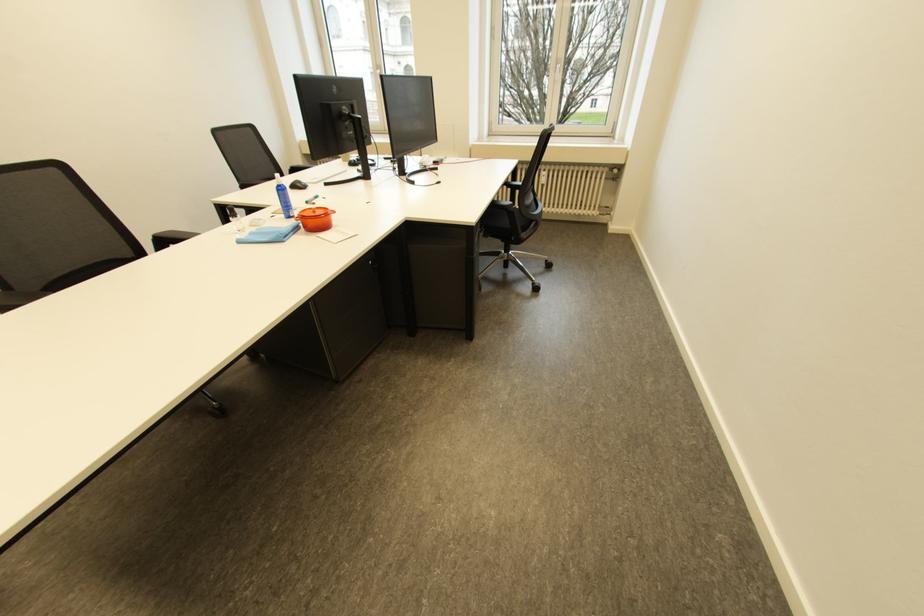
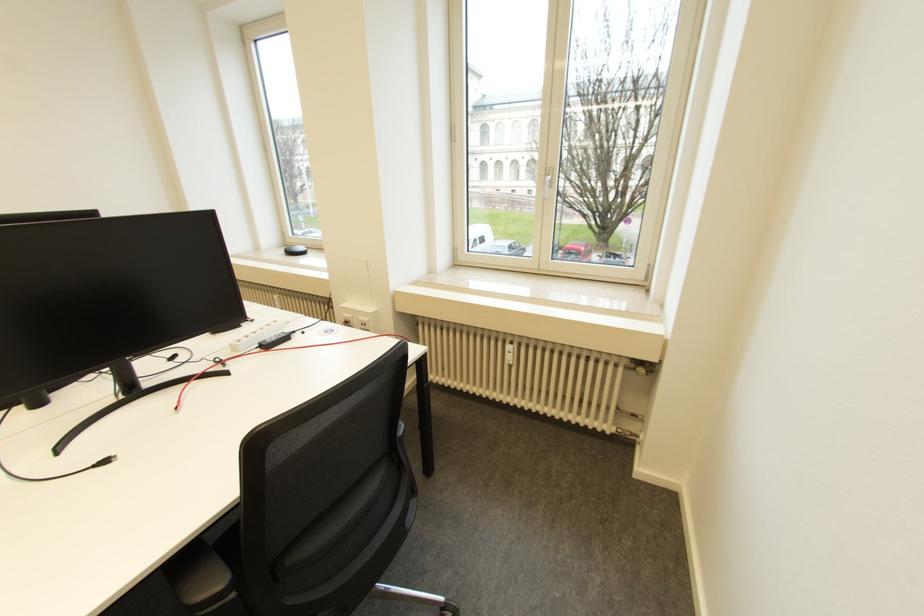
What movement of the cameraman would produce the second image?

The cameraman walked toward right, forward.